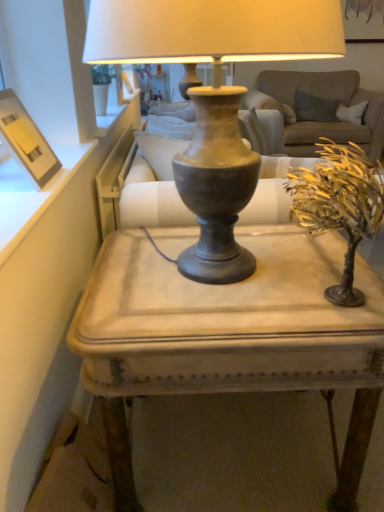
Question: Is gold textured tree at right further to the viewer compared to matte wood picture frame at upper left?

Choices:
 (A) no
 (B) yes

Answer: (A)

Question: From the image's perspective, is gold textured tree at right located beneath matte wood picture frame at upper left?

Choices:
 (A) no
 (B) yes

Answer: (B)

Question: Is gold textured tree at right closer to camera compared to matte wood picture frame at upper left?

Choices:
 (A) no
 (B) yes

Answer: (B)

Question: Does gold textured tree at right appear on the right side of matte wood picture frame at upper left?

Choices:
 (A) yes
 (B) no

Answer: (A)

Question: Could you tell me if gold textured tree at right is facing matte wood picture frame at upper left?

Choices:
 (A) no
 (B) yes

Answer: (A)

Question: Based on their sizes in the image, would you say matte gray table at center is bigger or smaller than matte wood picture frame at upper left?

Choices:
 (A) big
 (B) small

Answer: (A)

Question: Would you say matte gray table at center is inside or outside matte wood picture frame at upper left?

Choices:
 (A) inside
 (B) outside

Answer: (B)

Question: Looking at their shapes, would you say matte gray table at center is wider or thinner than matte wood picture frame at upper left?

Choices:
 (A) wide
 (B) thin

Answer: (A)

Question: Does point (319, 386) appear closer or farther from the camera than point (6, 97)?

Choices:
 (A) farther
 (B) closer

Answer: (B)

Question: Considering the positions of point (140, 47) and point (167, 344), is point (140, 47) closer or farther from the camera than point (167, 344)?

Choices:
 (A) farther
 (B) closer

Answer: (B)

Question: Considering the positions of matte gray vase at center and matte gray table at center in the image, is matte gray vase at center taller or shorter than matte gray table at center?

Choices:
 (A) tall
 (B) short

Answer: (A)

Question: Looking at the image, does matte gray vase at center seem bigger or smaller compared to matte gray table at center?

Choices:
 (A) small
 (B) big

Answer: (A)

Question: From the image's perspective, is matte gray vase at center above or below matte gray table at center?

Choices:
 (A) below
 (B) above

Answer: (B)

Question: Is point (24, 141) closer or farther from the camera than point (379, 202)?

Choices:
 (A) farther
 (B) closer

Answer: (A)

Question: Is matte wood picture frame at upper left inside or outside of gold textured tree at right?

Choices:
 (A) outside
 (B) inside

Answer: (A)